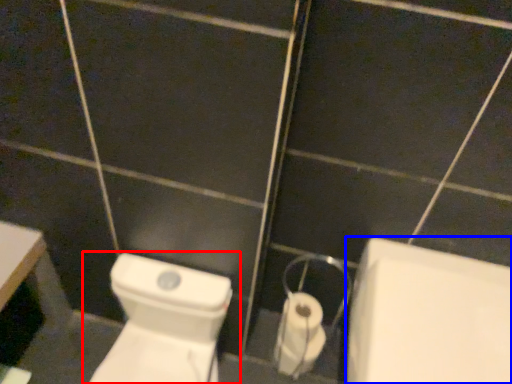
Question: Which object appears farthest to the camera in this image, toilet (highlighted by a red box) or bath (highlighted by a blue box)?

Choices:
 (A) toilet
 (B) bath

Answer: (A)